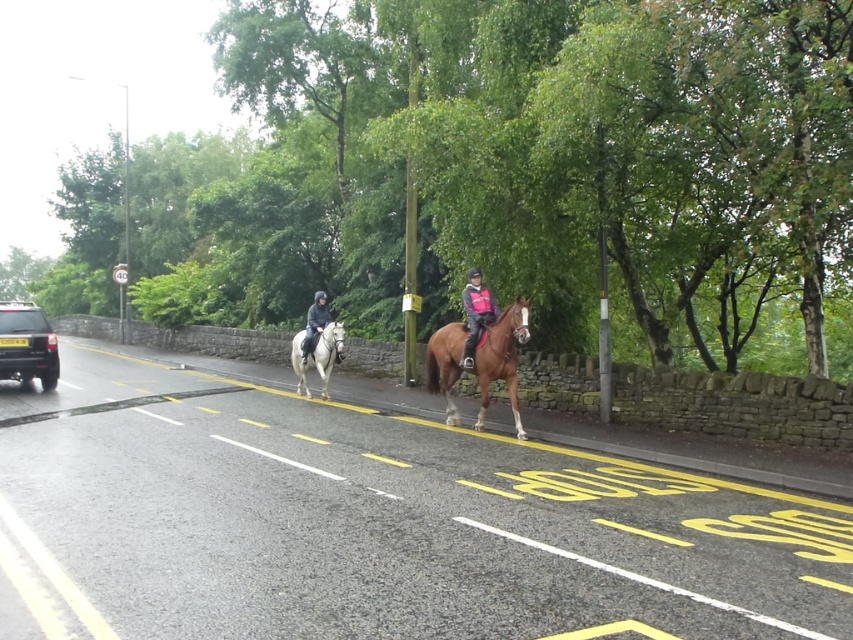
You are a pedestrian standing on the sidewalk next to the low stone wall. You see the brown glossy horse at center and the dark blue fabric jacket at center. Which object is taller?

The brown glossy horse at center is taller than the dark blue fabric jacket at center.

You are a delivery drone trying to navigate between two points on the road in the image. The first point is at coordinates point[506,362] and the second point is at point[18,380]. According to the scene, which point should you reach first while moving along the road?

Point[506,362] is in front of point[18,380], so you should reach point[506,362] first.

You are a pedestrian crossing the street and see the black matte suv at left and the white glossy horse at center. Which one is closer to you?

The black matte suv at left is closer to you because the white glossy horse at center is behind it.